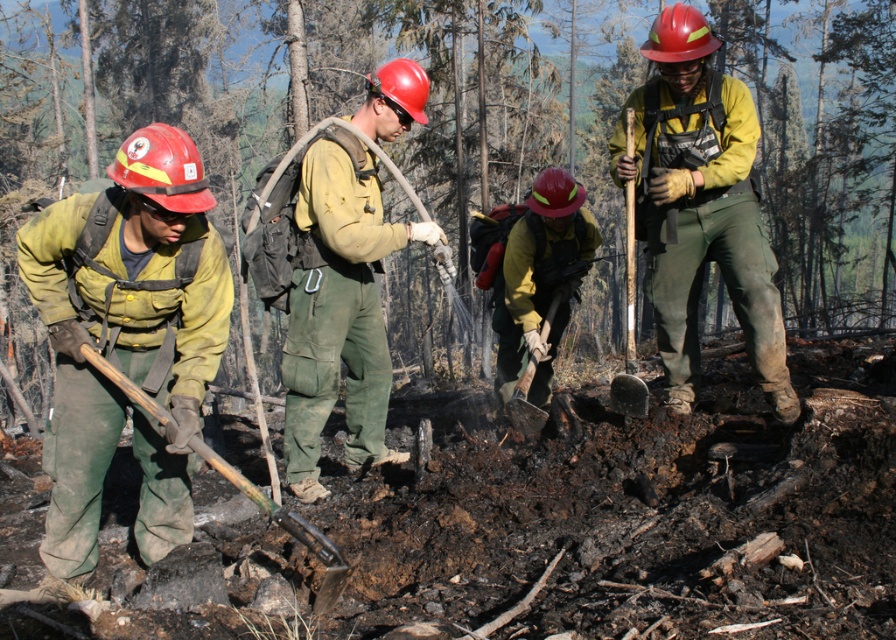
Between green canvas pants at center and matte green pants at center, which one has less height?

matte green pants at center

The width and height of the screenshot is (896, 640). Find the location of `green canvas pants at center`. green canvas pants at center is located at coordinates (701, 205).

Locate an element on the screen. green canvas pants at center is located at coordinates (701, 205).

Who is positioned more to the right, green canvas pants at center or wooden shovel at center?

From the viewer's perspective, green canvas pants at center appears more on the right side.

Is green canvas pants at center shorter than wooden shovel at center?

In fact, green canvas pants at center may be taller than wooden shovel at center.

Where is `green canvas pants at center`? The height and width of the screenshot is (640, 896). green canvas pants at center is located at coordinates (701, 205).

Where is `green canvas pants at center`? The width and height of the screenshot is (896, 640). green canvas pants at center is located at coordinates (701, 205).

In the scene shown: Is wooden handle shovel at lower left smaller than rusty metal shovel at center?

Correct, wooden handle shovel at lower left occupies less space than rusty metal shovel at center.

Does wooden handle shovel at lower left appear under rusty metal shovel at center?

Correct, wooden handle shovel at lower left is located below rusty metal shovel at center.

Does point (256, 486) come closer to viewer compared to point (633, 225)?

Yes.

In order to click on wooden handle shovel at lower left in this screenshot , I will do `click(289, 529)`.